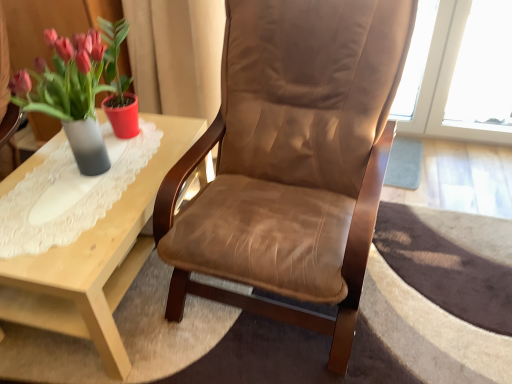
The image size is (512, 384). Find the location of `light wood coffee table at left`. light wood coffee table at left is located at coordinates (96, 260).

Between brown leather chair at center and matte gray vase at left, which one has more height?

brown leather chair at center is taller.

Is brown leather chair at center wider than matte gray vase at left?

Yes.

Measure the distance from brown leather chair at center to matte gray vase at left.

brown leather chair at center is 54.66 centimeters from matte gray vase at left.

Between point (270, 166) and point (67, 71), which one is positioned behind?

The point (270, 166) is farther.

Is matte gray vase at left directly adjacent to brown leather chair at center?

No, matte gray vase at left is not making contact with brown leather chair at center.

Is brown leather chair at center completely or partially inside matte gray vase at left?

Definitely not — brown leather chair at center is not inside matte gray vase at left.

Between matte gray vase at left and brown leather chair at center, which one has smaller width?

With smaller width is matte gray vase at left.

From a real-world perspective, is matte gray vase at left located beneath brown leather chair at center?

Actually, matte gray vase at left is physically above brown leather chair at center in the real world.

From a real-world perspective, is light wood coffee table at left physically located above or below matte gray vase at left?

light wood coffee table at left is situated lower than matte gray vase at left in the real world.

Considering the relative sizes of light wood coffee table at left and matte gray vase at left in the image provided, is light wood coffee table at left smaller than matte gray vase at left?

No.

Is light wood coffee table at left facing towards matte gray vase at left?

No, light wood coffee table at left does not turn towards matte gray vase at left.

From the picture: Based on their positions, is light wood coffee table at left located to the left or right of matte gray vase at left?

Based on their positions, light wood coffee table at left is located to the right of matte gray vase at left.

Locate an element on the screen. coffee table behind the brown leather chair at center is located at coordinates (96, 260).

Does light wood coffee table at left have a larger size compared to brown leather chair at center?

Actually, light wood coffee table at left might be smaller than brown leather chair at center.

Is brown leather chair at center completely or partially inside light wood coffee table at left?

No.

Measure the distance from matte gray vase at left to light wood coffee table at left.

matte gray vase at left and light wood coffee table at left are 13.83 inches apart from each other.

Where is `houseplant above the light wood coffee table at left (from the image's perspective)`? houseplant above the light wood coffee table at left (from the image's perspective) is located at coordinates (75, 89).

Considering the sizes of objects matte gray vase at left and light wood coffee table at left in the image provided, who is bigger, matte gray vase at left or light wood coffee table at left?

light wood coffee table at left.

Can you confirm if matte gray vase at left is shorter than light wood coffee table at left?

No, matte gray vase at left is not shorter than light wood coffee table at left.

Between brown leather chair at center and light wood coffee table at left, which one has more height?

Standing taller between the two is brown leather chair at center.

Is brown leather chair at center turned away from light wood coffee table at left?

No.

From the image's perspective, between brown leather chair at center and light wood coffee table at left, which one is located above?

brown leather chair at center, from the image's perspective.

Is brown leather chair at center inside or outside of light wood coffee table at left?

brown leather chair at center is outside light wood coffee table at left.

You are a GUI agent. You are given a task and a screenshot of the screen. Output one action in this format:
    pyautogui.click(x=<x>, y=<y>)
    Task: Click on the chair lying in front of the matte gray vase at left
    The image size is (512, 384).
    Given the screenshot: What is the action you would take?
    tap(291, 161)

Where is `chair below the matte gray vase at left (from a real-world perspective)`? The width and height of the screenshot is (512, 384). chair below the matte gray vase at left (from a real-world perspective) is located at coordinates (291, 161).

Which object lies further to the anchor point matte gray vase at left, brown leather chair at center or light wood coffee table at left?

brown leather chair at center.

Looking at the image, which one is located further to light wood coffee table at left, brown leather chair at center or matte gray vase at left?

matte gray vase at left.

Based on their spatial positions, is light wood coffee table at left or brown leather chair at center closer to matte gray vase at left?

light wood coffee table at left.

Considering their positions, is matte gray vase at left positioned further to brown leather chair at center than light wood coffee table at left?

matte gray vase at left.

Considering their positions, is light wood coffee table at left positioned further to brown leather chair at center than matte gray vase at left?

The object further to brown leather chair at center is matte gray vase at left.

Estimate the real-world distances between objects in this image. Which object is further from light wood coffee table at left, matte gray vase at left or brown leather chair at center?

matte gray vase at left lies further to light wood coffee table at left than the other object.

The width and height of the screenshot is (512, 384). I want to click on coffee table situated between matte gray vase at left and brown leather chair at center from left to right, so click(x=96, y=260).